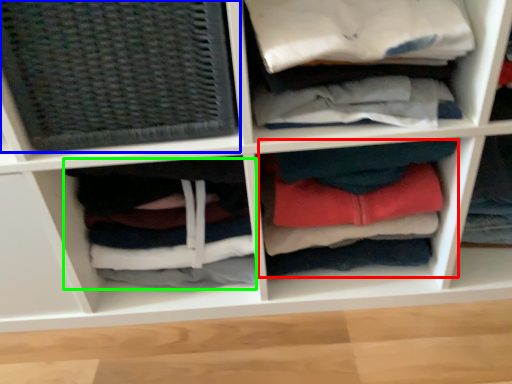
Question: Which object is the closest to the clothing (highlighted by a red box)? Choose among these: basket (highlighted by a blue box) or clothing (highlighted by a green box).

Choices:
 (A) basket
 (B) clothing

Answer: (B)